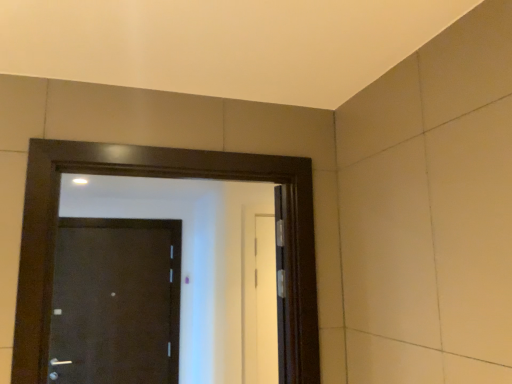
Question: Do you think matte black door at center, placed as the first door when sorted from left to right, is within black glossy door at center, which appears as the 2th door when viewed from the back, or outside of it?

Choices:
 (A) outside
 (B) inside

Answer: (A)

Question: Looking at their shapes, would you say matte black door at center, placed as the 1th door when sorted from back to front, is wider or thinner than black glossy door at center, which ranks as the 2th door in left-to-right order?

Choices:
 (A) wide
 (B) thin

Answer: (B)

Question: Is matte black door at center, the 2th door in the right-to-left sequence, to the left or to the right of black glossy door at center, which ranks as the 2th door in left-to-right order, in the image?

Choices:
 (A) left
 (B) right

Answer: (A)

Question: From the image's perspective, is black glossy door at center, which ranks as the 2th door in left-to-right order, located above or below matte black door at center, placed as the 1th door when sorted from back to front?

Choices:
 (A) below
 (B) above

Answer: (B)

Question: Is black glossy door at center, which ranks as the 2th door in left-to-right order, bigger or smaller than matte black door at center, the second door viewed from the front?

Choices:
 (A) big
 (B) small

Answer: (A)

Question: Is black glossy door at center, which is counted as the 1th door, starting from the right, in front of or behind matte black door at center, the 2th door in the right-to-left sequence, in the image?

Choices:
 (A) behind
 (B) front

Answer: (B)

Question: In terms of height, does black glossy door at center, which appears as the 2th door when viewed from the back, look taller or shorter compared to matte black door at center, placed as the first door when sorted from left to right?

Choices:
 (A) tall
 (B) short

Answer: (B)